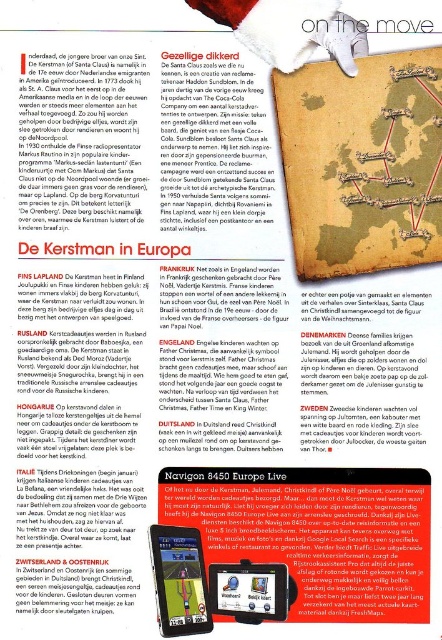
Does matte black santa claus at upper center lie in front of white paper text at upper center?

No, matte black santa claus at upper center is behind white paper text at upper center.

Can you confirm if matte black santa claus at upper center is smaller than white paper text at upper center?

No.

Is point (221, 76) farther from camera compared to point (53, 564)?

That is True.

Find the location of a particular element. This screenshot has width=442, height=640. matte black santa claus at upper center is located at coordinates (212, 144).

Is matte black laptop at upper center above matte black santa claus at upper center?

Incorrect, matte black laptop at upper center is not positioned above matte black santa claus at upper center.

Which of these two, matte black laptop at upper center or matte black santa claus at upper center, stands shorter?

matte black laptop at upper center

This screenshot has height=640, width=442. What do you see at coordinates (317, 541) in the screenshot?
I see `matte black laptop at upper center` at bounding box center [317, 541].

In order to click on matte black laptop at upper center in this screenshot , I will do `click(317, 541)`.

Does green paper map at upper center come in front of matte black santa claus at upper center?

Yes.

Is point (297, 97) positioned in front of point (174, 163)?

Yes, it is.

Locate an element on the screen. green paper map at upper center is located at coordinates (362, 163).